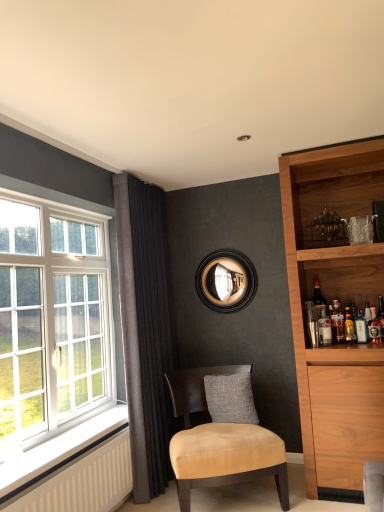
Question: Does dark grey velvet curtain at left have a greater height compared to translucent glass bottle at right, placed as the first beverage when sorted from right to left?

Choices:
 (A) no
 (B) yes

Answer: (B)

Question: Can you confirm if dark grey velvet curtain at left is positioned to the left of translucent glass bottle at right, placed as the first beverage when sorted from right to left?

Choices:
 (A) yes
 (B) no

Answer: (A)

Question: Considering the relative sizes of dark grey velvet curtain at left and translucent glass bottle at right, placed as the first beverage when sorted from right to left, in the image provided, is dark grey velvet curtain at left thinner than translucent glass bottle at right, placed as the first beverage when sorted from right to left,?

Choices:
 (A) no
 (B) yes

Answer: (A)

Question: Does dark grey velvet curtain at left have a smaller size compared to translucent glass bottle at right, placed as the first beverage when sorted from right to left?

Choices:
 (A) no
 (B) yes

Answer: (A)

Question: Is dark grey velvet curtain at left next to translucent glass bottle at right, placed as the first beverage when sorted from right to left, and touching it?

Choices:
 (A) yes
 (B) no

Answer: (B)

Question: Is dark grey velvet curtain at left not near translucent glass bottle at right, placed as the first beverage when sorted from right to left?

Choices:
 (A) no
 (B) yes

Answer: (B)

Question: Is translucent glass bottle at right, which ranks as the 3th beverage in left-to-right order, completely or partially outside of white glass window at left?

Choices:
 (A) no
 (B) yes

Answer: (B)

Question: Is translucent glass bottle at right, which ranks as the 3th beverage in left-to-right order, positioned behind white glass window at left?

Choices:
 (A) yes
 (B) no

Answer: (A)

Question: Could you tell me if translucent glass bottle at right, which ranks as the 3th beverage in left-to-right order, is facing white glass window at left?

Choices:
 (A) yes
 (B) no

Answer: (B)

Question: Is white glass window at left at the back of translucent glass bottle at right, which ranks as the 3th beverage in left-to-right order?

Choices:
 (A) yes
 (B) no

Answer: (B)

Question: Does translucent glass bottle at right, the 2th beverage from the right, have a lesser width compared to white glass window at left?

Choices:
 (A) no
 (B) yes

Answer: (B)

Question: Does translucent glass bottle at right, the 2th beverage from the right, appear on the left side of white glass window at left?

Choices:
 (A) no
 (B) yes

Answer: (A)

Question: Is white textured radiator at lower left oriented towards clear glass bottle at upper right, placed as the 1th beverage when sorted from left to right?

Choices:
 (A) no
 (B) yes

Answer: (A)